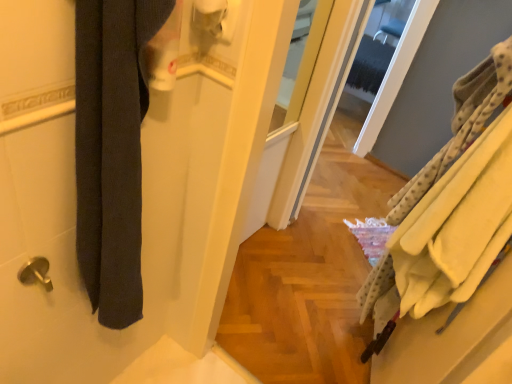
Image resolution: width=512 pixels, height=384 pixels. What are the coordinates of `yellow fleece bath towel at right, arranged as the first bath towel when viewed from the right` in the screenshot? It's located at (460, 124).

Image resolution: width=512 pixels, height=384 pixels. Describe the element at coordinates (112, 150) in the screenshot. I see `dark gray fabric at left, marked as the 1th bath towel in a left-to-right arrangement` at that location.

Image resolution: width=512 pixels, height=384 pixels. I want to click on dark gray fabric at left, marked as the 1th bath towel in a left-to-right arrangement, so click(112, 150).

The image size is (512, 384). I want to click on white matte toilet paper at upper center, so click(210, 15).

What do you see at coordinates (210, 15) in the screenshot?
I see `white matte toilet paper at upper center` at bounding box center [210, 15].

At what (x,y) coordinates should I click in order to perform the action: click on yellow fleece bath towel at right, arranged as the first bath towel when viewed from the right. Please return your answer as a coordinate pair (x, y). This screenshot has width=512, height=384. Looking at the image, I should click on 460,124.

Considering the positions of point (131, 257) and point (416, 174), is point (131, 257) closer or farther from the camera than point (416, 174)?

Point (131, 257).

Is yellow fleece bath towel at right, placed as the 2th bath towel when sorted from left to right, inside dark gray fabric at left, marked as the 1th bath towel in a left-to-right arrangement?

No, yellow fleece bath towel at right, placed as the 2th bath towel when sorted from left to right, is not surrounded by dark gray fabric at left, marked as the 1th bath towel in a left-to-right arrangement.

From a real-world perspective, between white matte toilet paper at upper center and yellow fleece bath towel at right, placed as the 2th bath towel when sorted from left to right, who is vertically higher?

From a 3D spatial view, white matte toilet paper at upper center is above.

Does point (197, 18) lie behind point (457, 99)?

No, it is not.

Looking at this image, how many degrees apart are the facing directions of white matte toilet paper at upper center and yellow fleece bath towel at right, arranged as the first bath towel when viewed from the right?

white matte toilet paper at upper center and yellow fleece bath towel at right, arranged as the first bath towel when viewed from the right, are facing 78.7 degrees away from each other.

Is white matte toilet paper at upper center taller than yellow fleece bath towel at right, placed as the 2th bath towel when sorted from left to right?

Incorrect, the height of white matte toilet paper at upper center is not larger of that of yellow fleece bath towel at right, placed as the 2th bath towel when sorted from left to right.

Is yellow fleece bath towel at right, placed as the 2th bath towel when sorted from left to right, far from white matte toilet paper at upper center?

Actually, yellow fleece bath towel at right, placed as the 2th bath towel when sorted from left to right, and white matte toilet paper at upper center are a little close together.

From a real-world perspective, which object stands above the other?

In real-world perspective, white matte toilet paper at upper center is above.

Considering the sizes of objects yellow fleece bath towel at right, placed as the 2th bath towel when sorted from left to right, and white matte toilet paper at upper center in the image provided, who is shorter, yellow fleece bath towel at right, placed as the 2th bath towel when sorted from left to right, or white matte toilet paper at upper center?

white matte toilet paper at upper center is shorter.

In the image, is yellow fleece bath towel at right, placed as the 2th bath towel when sorted from left to right, positioned in front of or behind white matte toilet paper at upper center?

Visually, yellow fleece bath towel at right, placed as the 2th bath towel when sorted from left to right, is located behind white matte toilet paper at upper center.

Which is correct: yellow fleece bath towel at right, arranged as the first bath towel when viewed from the right, is inside dark gray fabric at left, marked as the second bath towel in a right-to-left arrangement, or outside of it?

yellow fleece bath towel at right, arranged as the first bath towel when viewed from the right, is not enclosed by dark gray fabric at left, marked as the second bath towel in a right-to-left arrangement.

Looking at this image, is yellow fleece bath towel at right, placed as the 2th bath towel when sorted from left to right, to the left of dark gray fabric at left, marked as the 1th bath towel in a left-to-right arrangement, from the viewer's perspective?

No, yellow fleece bath towel at right, placed as the 2th bath towel when sorted from left to right, is not to the left of dark gray fabric at left, marked as the 1th bath towel in a left-to-right arrangement.

Can you confirm if yellow fleece bath towel at right, arranged as the first bath towel when viewed from the right, is wider than dark gray fabric at left, marked as the 1th bath towel in a left-to-right arrangement?

Yes.

Is yellow fleece bath towel at right, arranged as the first bath towel when viewed from the right, positioned with its back to dark gray fabric at left, marked as the second bath towel in a right-to-left arrangement?

No, dark gray fabric at left, marked as the second bath towel in a right-to-left arrangement, is not at the back of yellow fleece bath towel at right, arranged as the first bath towel when viewed from the right.

From the image's perspective, which object appears higher, dark gray fabric at left, marked as the 1th bath towel in a left-to-right arrangement, or white matte toilet paper at upper center?

white matte toilet paper at upper center.

Could you measure the distance between dark gray fabric at left, marked as the second bath towel in a right-to-left arrangement, and white matte toilet paper at upper center?

14.21 inches.

Is dark gray fabric at left, marked as the second bath towel in a right-to-left arrangement, closer to camera compared to white matte toilet paper at upper center?

Yes, the depth of dark gray fabric at left, marked as the second bath towel in a right-to-left arrangement, is less than that of white matte toilet paper at upper center.

Is dark gray fabric at left, marked as the second bath towel in a right-to-left arrangement, to the right of white matte toilet paper at upper center from the viewer's perspective?

In fact, dark gray fabric at left, marked as the second bath towel in a right-to-left arrangement, is to the left of white matte toilet paper at upper center.

Is white matte toilet paper at upper center at the left side of dark gray fabric at left, marked as the second bath towel in a right-to-left arrangement?

In fact, white matte toilet paper at upper center is to the right of dark gray fabric at left, marked as the second bath towel in a right-to-left arrangement.

Who is taller, white matte toilet paper at upper center or dark gray fabric at left, marked as the second bath towel in a right-to-left arrangement?

Standing taller between the two is dark gray fabric at left, marked as the second bath towel in a right-to-left arrangement.

Considering the relative sizes of white matte toilet paper at upper center and dark gray fabric at left, marked as the second bath towel in a right-to-left arrangement, in the image provided, is white matte toilet paper at upper center wider than dark gray fabric at left, marked as the second bath towel in a right-to-left arrangement,?

In fact, white matte toilet paper at upper center might be narrower than dark gray fabric at left, marked as the second bath towel in a right-to-left arrangement.

Which object is further away from the camera taking this photo, white matte toilet paper at upper center or dark gray fabric at left, marked as the 1th bath towel in a left-to-right arrangement?

white matte toilet paper at upper center is further from the camera.

Find the location of a particular element. bath towel on the right of the dark gray fabric at left, marked as the second bath towel in a right-to-left arrangement is located at coordinates (460, 124).

Locate an element on the screen. the 1st bath towel below the white matte toilet paper at upper center (from the image's perspective) is located at coordinates point(460,124).

From the image, which object appears to be nearer to dark gray fabric at left, marked as the 1th bath towel in a left-to-right arrangement, white matte toilet paper at upper center or yellow fleece bath towel at right, arranged as the first bath towel when viewed from the right?

white matte toilet paper at upper center is positioned closer to the anchor dark gray fabric at left, marked as the 1th bath towel in a left-to-right arrangement.

Considering their positions, is yellow fleece bath towel at right, arranged as the first bath towel when viewed from the right, positioned closer to dark gray fabric at left, marked as the second bath towel in a right-to-left arrangement, than white matte toilet paper at upper center?

Based on the image, white matte toilet paper at upper center appears to be nearer to dark gray fabric at left, marked as the second bath towel in a right-to-left arrangement.

Considering their positions, is yellow fleece bath towel at right, arranged as the first bath towel when viewed from the right, positioned further to white matte toilet paper at upper center than dark gray fabric at left, marked as the second bath towel in a right-to-left arrangement?

Based on the image, yellow fleece bath towel at right, arranged as the first bath towel when viewed from the right, appears to be further to white matte toilet paper at upper center.

When comparing their distances from yellow fleece bath towel at right, arranged as the first bath towel when viewed from the right, does dark gray fabric at left, marked as the 1th bath towel in a left-to-right arrangement, or white matte toilet paper at upper center seem closer?

white matte toilet paper at upper center is closer to yellow fleece bath towel at right, arranged as the first bath towel when viewed from the right.

From the picture: Based on their spatial positions, is dark gray fabric at left, marked as the 1th bath towel in a left-to-right arrangement, or yellow fleece bath towel at right, placed as the 2th bath towel when sorted from left to right, further from white matte toilet paper at upper center?

yellow fleece bath towel at right, placed as the 2th bath towel when sorted from left to right, is further to white matte toilet paper at upper center.

Looking at this image, which object lies nearer to the anchor point yellow fleece bath towel at right, placed as the 2th bath towel when sorted from left to right, white matte toilet paper at upper center or dark gray fabric at left, marked as the second bath towel in a right-to-left arrangement?

Among the two, white matte toilet paper at upper center is located nearer to yellow fleece bath towel at right, placed as the 2th bath towel when sorted from left to right.

This screenshot has height=384, width=512. Find the location of `toilet paper situated between dark gray fabric at left, marked as the second bath towel in a right-to-left arrangement, and yellow fleece bath towel at right, arranged as the first bath towel when viewed from the right, from left to right`. toilet paper situated between dark gray fabric at left, marked as the second bath towel in a right-to-left arrangement, and yellow fleece bath towel at right, arranged as the first bath towel when viewed from the right, from left to right is located at coordinates (210, 15).